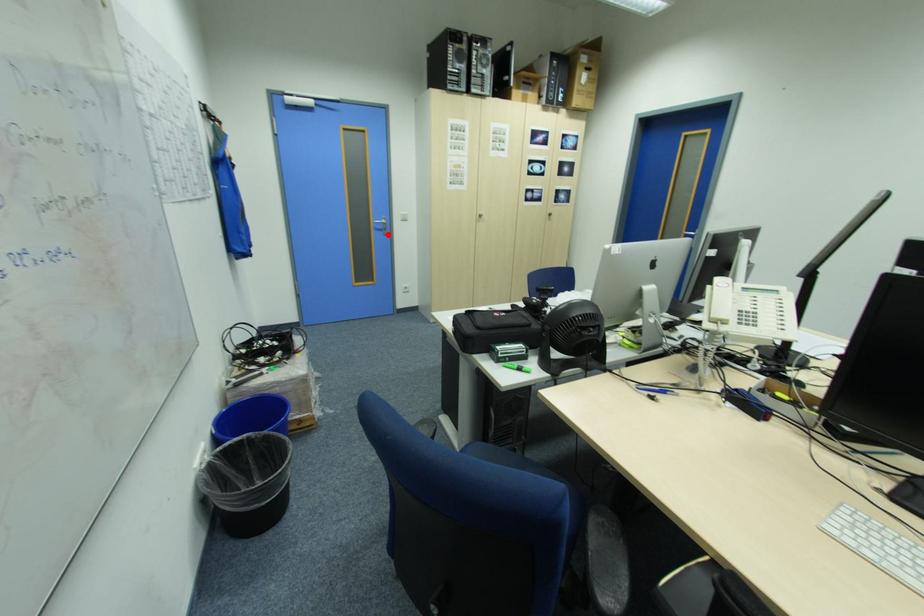
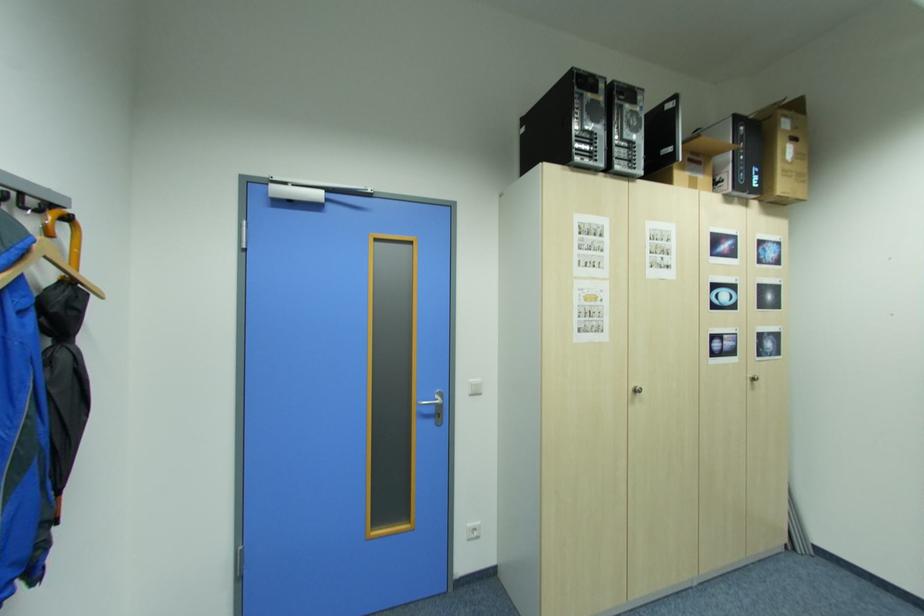
Where in the second image is the point corresponding to the highlighted location from the first image?

(438, 424)